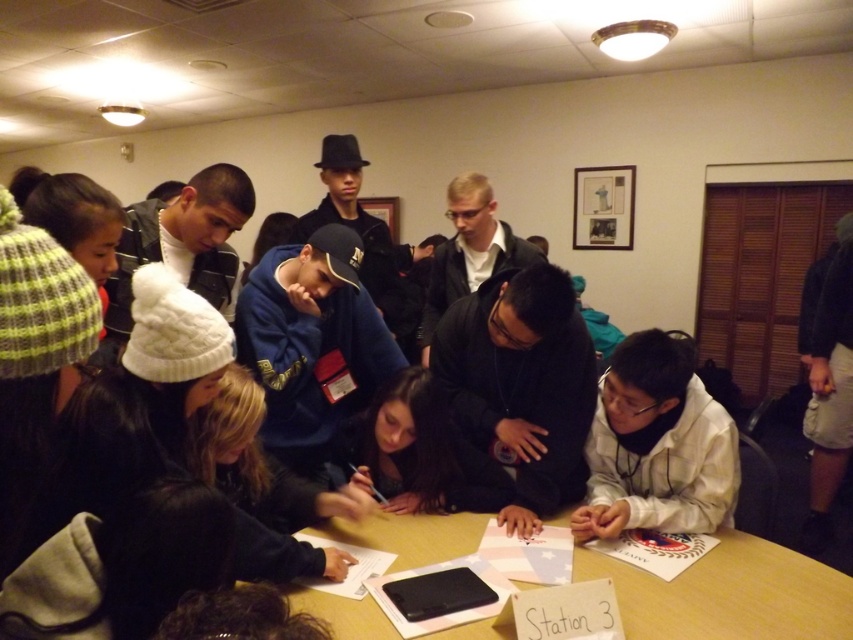
Question: Among these objects, which one is farthest from the camera?

Choices:
 (A) wooden table at center
 (B) white matte shirt at lower right

Answer: (B)

Question: Can you confirm if wooden table at center is wider than white matte shirt at lower right?

Choices:
 (A) no
 (B) yes

Answer: (B)

Question: Can you confirm if wooden table at center is positioned to the right of white matte shirt at lower right?

Choices:
 (A) yes
 (B) no

Answer: (B)

Question: Can you confirm if wooden table at center is positioned to the left of white matte shirt at lower right?

Choices:
 (A) no
 (B) yes

Answer: (B)

Question: Which object is closer to the camera taking this photo?

Choices:
 (A) wooden table at center
 (B) white matte shirt at lower right

Answer: (A)